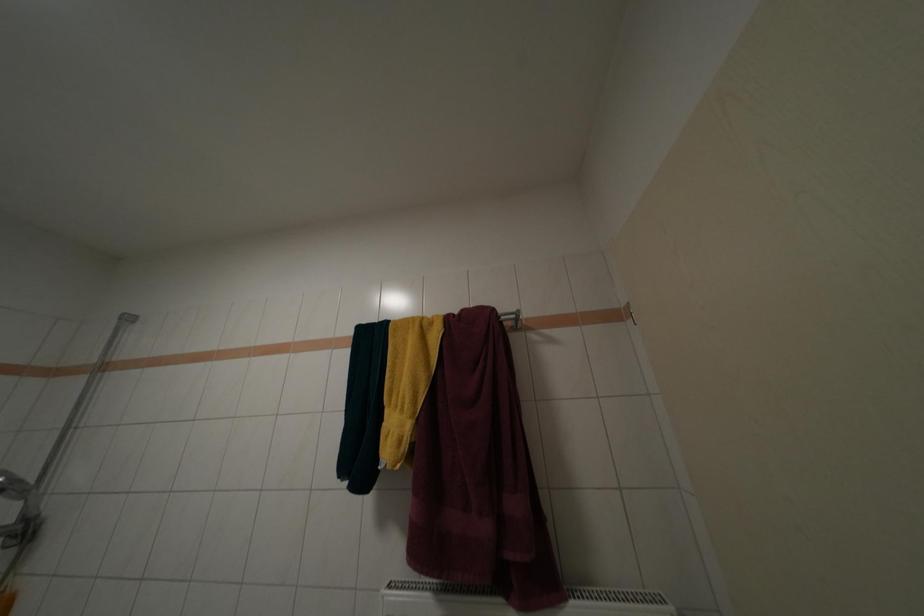
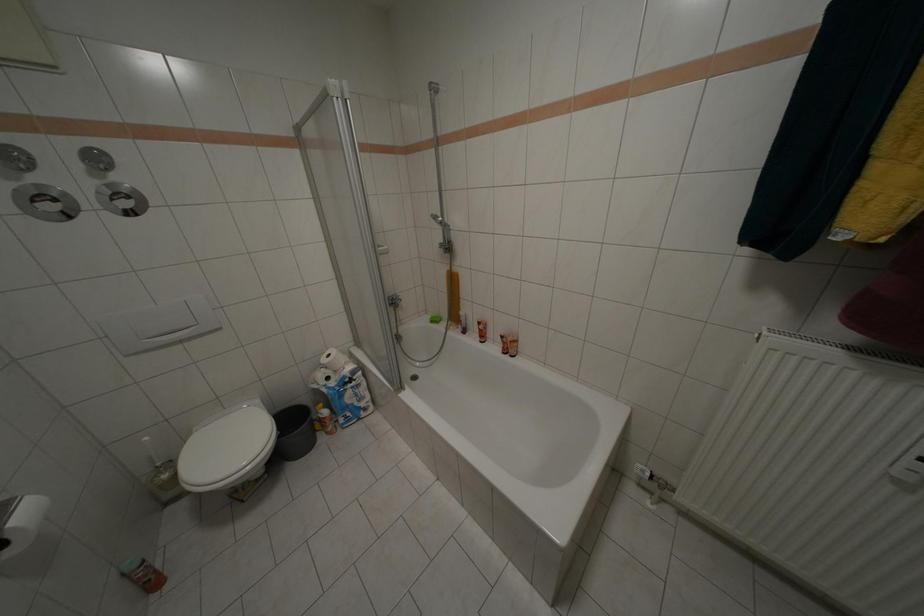
Based on the continuous images, in which direction is the camera rotating?

The camera rotated toward left-down.